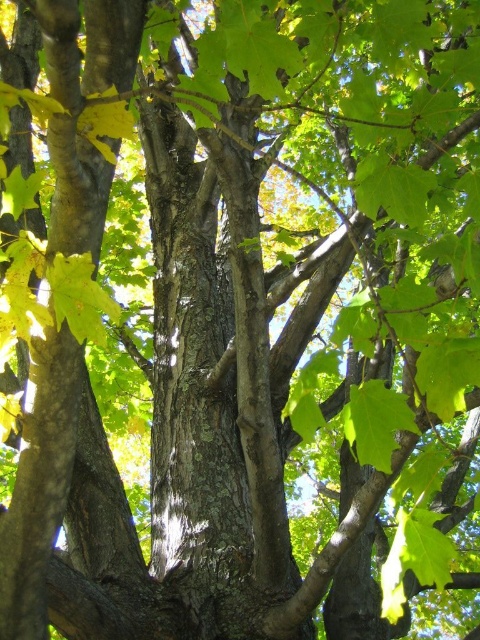
You are an artist sketching this tree and want to draw the green matte leaf at lower right and the green matte maple leaf at upper left. Which leaf should you draw first if you are following the order from closest to farthest from your viewpoint?

You should draw the green matte leaf at lower right first because it is closer to you than the green matte maple leaf at upper left.

You are an artist trying to paint the tree. You have two leaves to reference, the green matte leaf at lower right and the green matte maple leaf at upper left. Which leaf should you choose if you want to depict a larger leaf in your painting?

You should choose the green matte leaf at lower right because its width is larger than the green matte maple leaf at upper left.